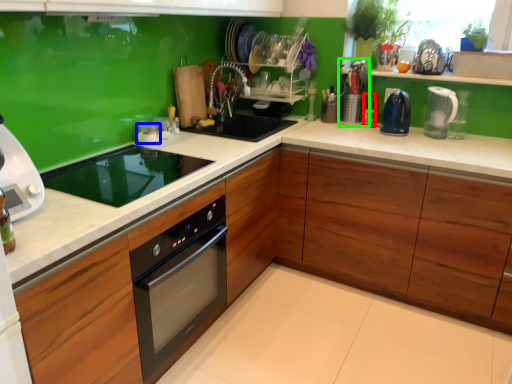
Question: Which object is the closest to the bottle (highlighted by a red box)? Choose among these: appliance (highlighted by a blue box) or appliance (highlighted by a green box).

Choices:
 (A) appliance
 (B) appliance

Answer: (B)